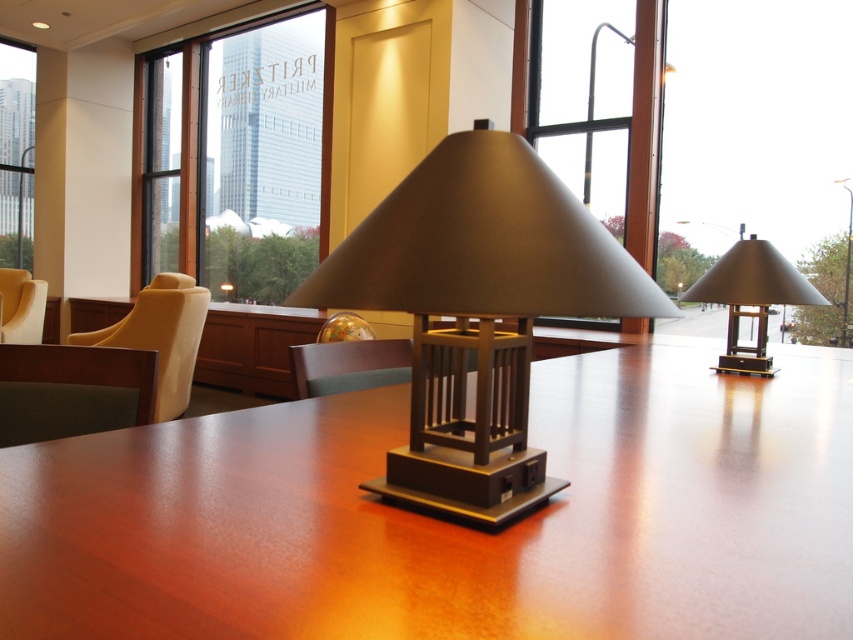
You are sitting in the green fabric chair at lower left and want to see the view outside the transparent glass window at left. Can you tell if the window is wider than the chair?

The green fabric chair at lower left is less in width than transparent glass window at left, so yes, the transparent glass window at left is wider than the green fabric chair at lower left.

You are standing in the library and see two points marked on the floor. The first point is at coordinates point (102, 355) and the second is at point (24, 248). Which point is closer to you?

Point (102, 355) is in front of point (24, 248), so it is closer to you.